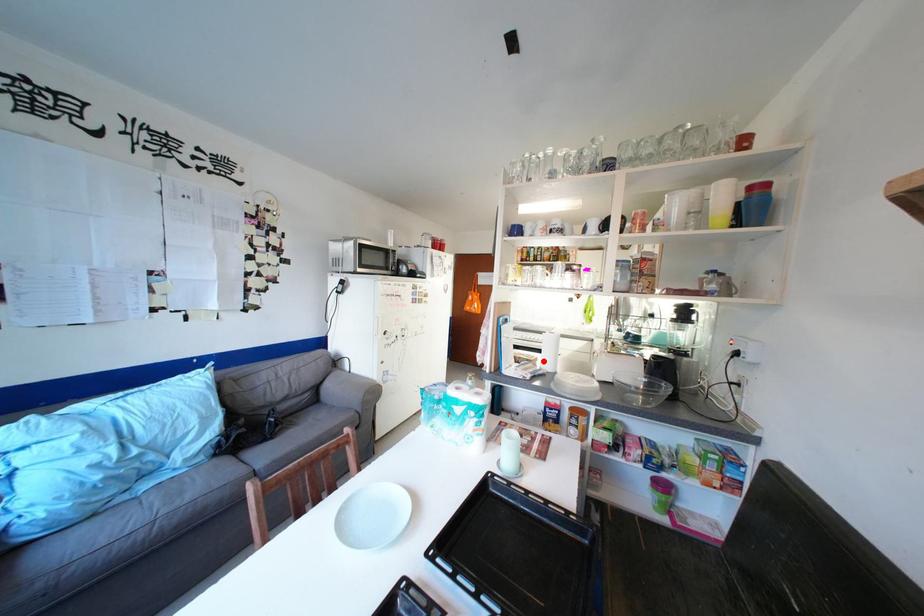
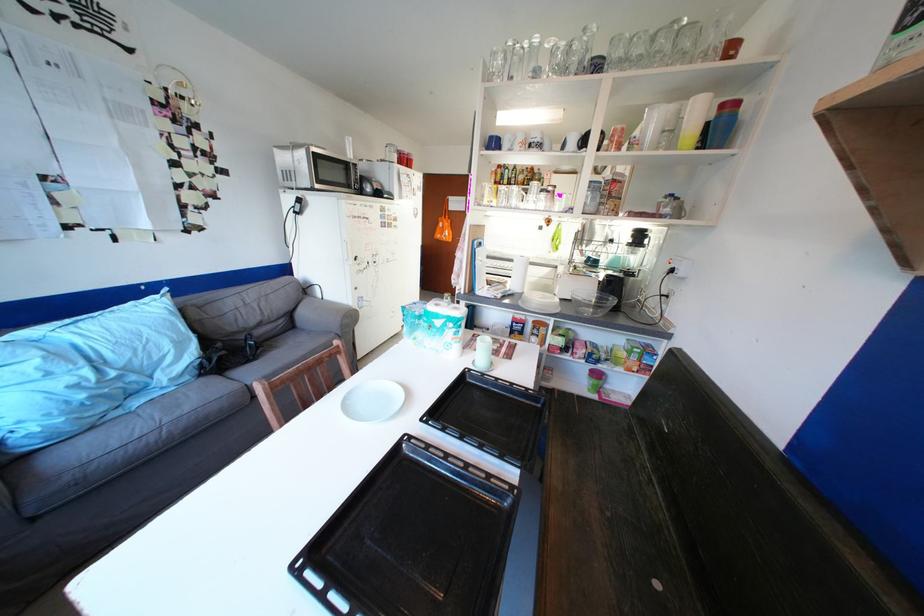
The point at the highlighted location is marked in the first image. Where is the corresponding point in the second image?

(514, 284)